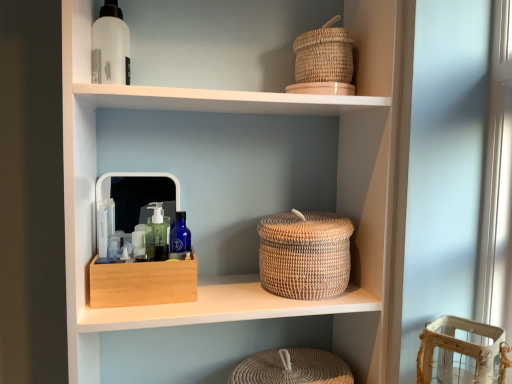
Question: Considering the relative sizes of woven beige basket at lower right, the first basket when ordered from bottom to top, and natural woven basket at center in the image provided, is woven beige basket at lower right, the first basket when ordered from bottom to top, wider than natural woven basket at center?

Choices:
 (A) no
 (B) yes

Answer: (A)

Question: Is there a large distance between woven beige basket at lower right, the 3th basket viewed from the top, and natural woven basket at center?

Choices:
 (A) no
 (B) yes

Answer: (A)

Question: Is natural woven basket at center surrounded by woven beige basket at lower right, the 3th basket viewed from the top?

Choices:
 (A) no
 (B) yes

Answer: (A)

Question: From a real-world perspective, is woven beige basket at lower right, the first basket when ordered from bottom to top, positioned under natural woven basket at center based on gravity?

Choices:
 (A) yes
 (B) no

Answer: (A)

Question: Is woven beige basket at lower right, the first basket when ordered from bottom to top, next to natural woven basket at center and touching it?

Choices:
 (A) yes
 (B) no

Answer: (B)

Question: From the image's perspective, is natural woven basket at center positioned above or below beech wood storage box at center?

Choices:
 (A) above
 (B) below

Answer: (A)

Question: Considering their positions, is natural woven basket at center located in front of or behind beech wood storage box at center?

Choices:
 (A) behind
 (B) front

Answer: (B)

Question: Considering the positions of natural woven basket at center and beech wood storage box at center in the image, is natural woven basket at center taller or shorter than beech wood storage box at center?

Choices:
 (A) short
 (B) tall

Answer: (B)

Question: Considering the relative positions of natural woven basket at center and beech wood storage box at center in the image provided, is natural woven basket at center to the left or to the right of beech wood storage box at center?

Choices:
 (A) left
 (B) right

Answer: (B)

Question: In terms of width, does woven beige basket at center, the 2th basket viewed from the top, look wider or thinner when compared to beech wood storage box at center?

Choices:
 (A) thin
 (B) wide

Answer: (B)

Question: Looking at the image, does woven beige basket at center, which is the 2th basket in bottom-to-top order, seem bigger or smaller compared to beech wood storage box at center?

Choices:
 (A) big
 (B) small

Answer: (A)

Question: Is woven beige basket at center, which is the 2th basket in bottom-to-top order, spatially inside beech wood storage box at center, or outside of it?

Choices:
 (A) inside
 (B) outside

Answer: (B)

Question: In the image, is woven beige basket at center, which is the 2th basket in bottom-to-top order, positioned in front of or behind beech wood storage box at center?

Choices:
 (A) front
 (B) behind

Answer: (B)

Question: Visually, is woven natural basket at upper right, which ranks as the 3th basket in bottom-to-top order, positioned to the left or to the right of natural woven basket at center?

Choices:
 (A) right
 (B) left

Answer: (A)

Question: Looking at the image, does woven natural basket at upper right, marked as the 1th basket in a top-to-bottom arrangement, seem bigger or smaller compared to natural woven basket at center?

Choices:
 (A) small
 (B) big

Answer: (A)